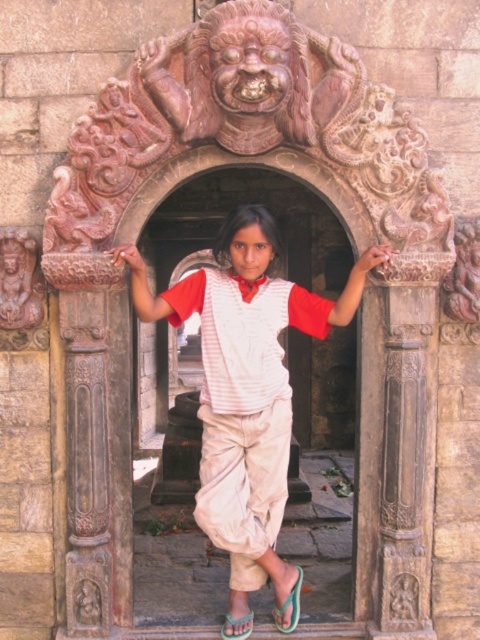
Question: Which point is farther from the camera taking this photo?

Choices:
 (A) (228, 636)
 (B) (297, 595)
 (C) (222, 465)

Answer: (B)

Question: Is white cotton shirt at center wider than green fabric sandal at lower center?

Choices:
 (A) no
 (B) yes

Answer: (B)

Question: Is white cotton shirt at center bigger than green rubber sandal at lower center?

Choices:
 (A) no
 (B) yes

Answer: (B)

Question: Can you confirm if white cotton shirt at center is positioned below green fabric sandal at lower center?

Choices:
 (A) yes
 (B) no

Answer: (B)

Question: Which point is closer to the camera taking this photo?

Choices:
 (A) (237, 620)
 (B) (285, 630)
 (C) (237, 260)

Answer: (B)

Question: Which of the following is the farthest from the observer?

Choices:
 (A) (218, 353)
 (B) (288, 625)

Answer: (B)